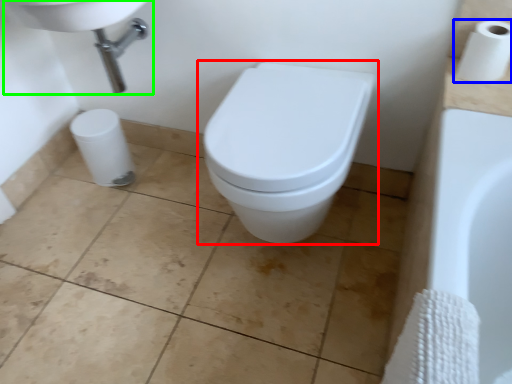
Question: Which object is positioned closest to toilet (highlighted by a red box)? Select from toilet paper (highlighted by a blue box) and sink (highlighted by a green box).

Choices:
 (A) toilet paper
 (B) sink

Answer: (A)